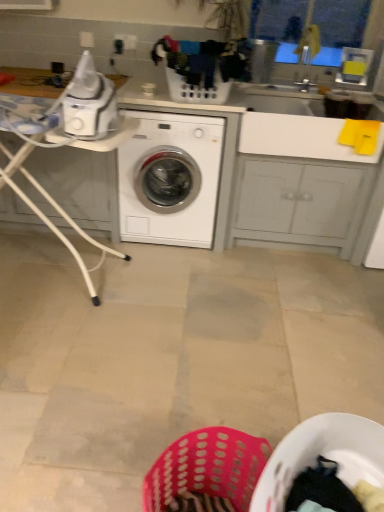
Locate an element on the screen. The image size is (384, 512). vacant space underneath white plastic table at left (from a real-world perspective) is located at coordinates (61, 269).